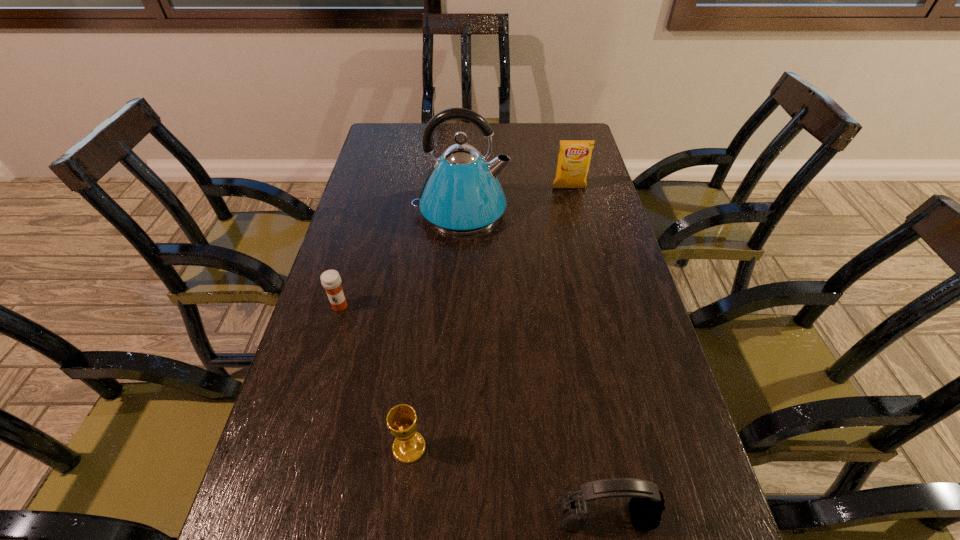
Where is `vacant space in between the crisp (potato chip) and the nearest object`? Image resolution: width=960 pixels, height=540 pixels. vacant space in between the crisp (potato chip) and the nearest object is located at coordinates (588, 353).

Where is `free spot between the third farthest object and the fourth farthest object`? free spot between the third farthest object and the fourth farthest object is located at coordinates (374, 376).

Image resolution: width=960 pixels, height=540 pixels. In order to click on the closest object to the tallest object in this screenshot , I will do click(x=574, y=157).

Identify which object is the closest to the medicine. Please provide its 2D coordinates. Your answer should be formatted as a tuple, i.e. [(x, y)], where the tuple contains the x and y coordinates of a point satisfying the conditions above.

[(462, 195)]

The image size is (960, 540). Identify the location of vacant position in the image that satisfies the following two spatial constraints: 1. at the spout of the kettle; 2. on the label side of the third nearest object. coord(455,306).